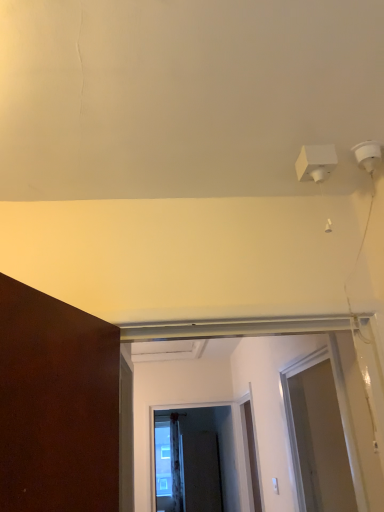
Question: Is clear glass screen door at center, which ranks as the 2th screen door in top-to-bottom order, a part of white matte door at center?

Choices:
 (A) no
 (B) yes

Answer: (A)

Question: Is white matte door at center directly adjacent to clear glass screen door at center, the second screen door viewed from the back?

Choices:
 (A) no
 (B) yes

Answer: (A)

Question: Can you confirm if white matte door at center is taller than clear glass screen door at center, the second screen door viewed from the back?

Choices:
 (A) yes
 (B) no

Answer: (A)

Question: Does white matte door at center have a larger size compared to clear glass screen door at center, which is the 2th screen door from front to back?

Choices:
 (A) yes
 (B) no

Answer: (A)

Question: Is white matte door at center at the right side of clear glass screen door at center, which appears as the second screen door when ordered from the bottom?

Choices:
 (A) no
 (B) yes

Answer: (B)

Question: Relative to transparent plastic screen door at right, acting as the third screen door starting from the bottom, is clear glass screen door at center, which is the 2th screen door from front to back, in front or behind?

Choices:
 (A) behind
 (B) front

Answer: (A)

Question: Does point (200, 415) appear closer or farther from the camera than point (339, 478)?

Choices:
 (A) closer
 (B) farther

Answer: (B)

Question: From the image's perspective, is clear glass screen door at center, which ranks as the 2th screen door in top-to-bottom order, located above or below transparent plastic screen door at right, positioned as the first screen door in top-to-bottom order?

Choices:
 (A) below
 (B) above

Answer: (A)

Question: Based on their sizes in the image, would you say clear glass screen door at center, which is the 2th screen door from front to back, is bigger or smaller than transparent plastic screen door at right, positioned as the first screen door in top-to-bottom order?

Choices:
 (A) big
 (B) small

Answer: (B)

Question: Based on their positions, is black matte screen door at center, positioned as the first screen door in back-to-front order, located to the left or right of clear glass screen door at center, the second screen door viewed from the back?

Choices:
 (A) right
 (B) left

Answer: (A)

Question: In the image, is black matte screen door at center, positioned as the first screen door in back-to-front order, positioned in front of or behind clear glass screen door at center, the second screen door viewed from the back?

Choices:
 (A) front
 (B) behind

Answer: (B)

Question: Considering the positions of black matte screen door at center, acting as the 3th screen door starting from the top, and clear glass screen door at center, the second screen door viewed from the back, in the image, is black matte screen door at center, acting as the 3th screen door starting from the top, bigger or smaller than clear glass screen door at center, the second screen door viewed from the back,?

Choices:
 (A) small
 (B) big

Answer: (B)

Question: Is black matte screen door at center, which is the first screen door in bottom-to-top order, inside or outside of clear glass screen door at center, which is the 2th screen door from front to back?

Choices:
 (A) inside
 (B) outside

Answer: (B)

Question: Do you think clear glass screen door at center, the second screen door viewed from the back, is within black matte screen door at center, positioned as the first screen door in back-to-front order, or outside of it?

Choices:
 (A) inside
 (B) outside

Answer: (B)

Question: Is clear glass screen door at center, which ranks as the 2th screen door in top-to-bottom order, in front of or behind black matte screen door at center, positioned as the first screen door in back-to-front order, in the image?

Choices:
 (A) behind
 (B) front

Answer: (B)